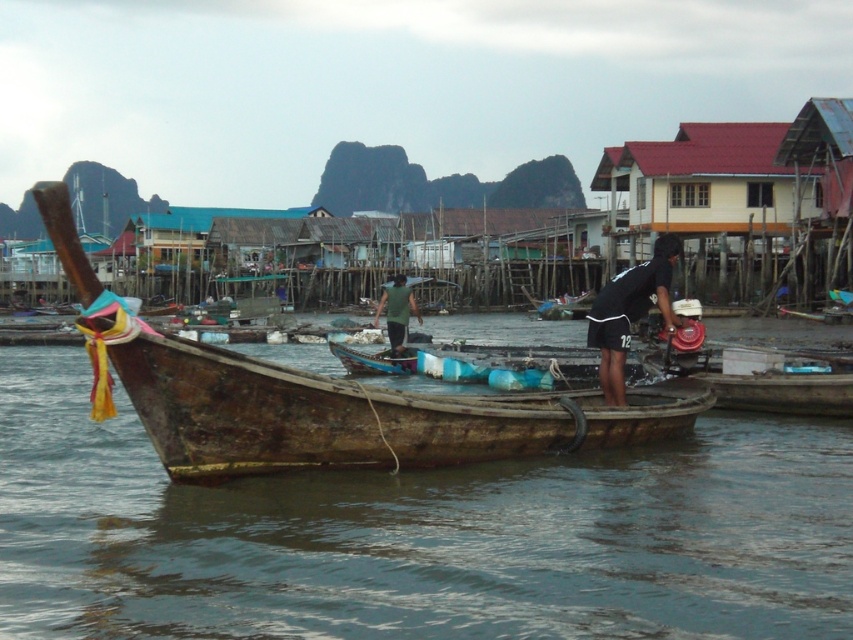
Question: Can you confirm if brown wooden boat at center is positioned to the left of black fabric shirt at center?

Choices:
 (A) no
 (B) yes

Answer: (B)

Question: Among these points, which one is nearest to the camera?

Choices:
 (A) (413, 298)
 (B) (628, 275)
 (C) (344, 465)

Answer: (C)

Question: Can you confirm if rusty wood boat at center is positioned to the right of black fabric shirt at center?

Choices:
 (A) yes
 (B) no

Answer: (B)

Question: Does rusty wood boat at center have a larger size compared to black fabric shirt at center?

Choices:
 (A) no
 (B) yes

Answer: (A)

Question: Estimate the real-world distances between objects in this image. Which object is farther from the brown wooden boat at center?

Choices:
 (A) green fabric shirt at center
 (B) black fabric shirt at center
 (C) rusty wood boat at center

Answer: (A)

Question: Which point is farther to the camera?

Choices:
 (A) rusty wood boat at center
 (B) black fabric shirt at center
 (C) green fabric shirt at center
 (D) brown wooden boat at center

Answer: (C)